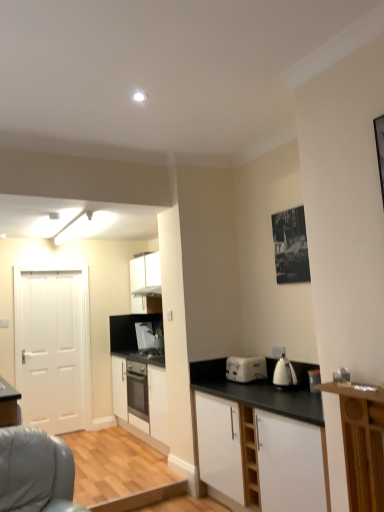
Question: Considering the relative positions of white matte door at left and black paper poster at upper right in the image provided, is white matte door at left to the left of black paper poster at upper right from the viewer's perspective?

Choices:
 (A) yes
 (B) no

Answer: (A)

Question: Is white matte door at left next to black paper poster at upper right and touching it?

Choices:
 (A) no
 (B) yes

Answer: (A)

Question: Can you confirm if white matte door at left is shorter than black paper poster at upper right?

Choices:
 (A) yes
 (B) no

Answer: (B)

Question: Would you say black paper poster at upper right is part of white matte door at left's contents?

Choices:
 (A) yes
 (B) no

Answer: (B)

Question: Is white matte door at left positioned beyond the bounds of black paper poster at upper right?

Choices:
 (A) yes
 (B) no

Answer: (A)

Question: From the image's perspective, is white matte door at left beneath black paper poster at upper right?

Choices:
 (A) no
 (B) yes

Answer: (B)

Question: Is white matte cabinet at lower right, marked as the 1th cabinetry in a front-to-back arrangement, beside white plastic toaster at center?

Choices:
 (A) no
 (B) yes

Answer: (A)

Question: Is white matte cabinet at lower right, marked as the 1th cabinetry in a front-to-back arrangement, positioned far away from white plastic toaster at center?

Choices:
 (A) no
 (B) yes

Answer: (A)

Question: Is white matte cabinet at lower right, marked as the 1th cabinetry in a front-to-back arrangement, smaller than white plastic toaster at center?

Choices:
 (A) no
 (B) yes

Answer: (A)

Question: Is white matte cabinet at lower right, marked as the 1th cabinetry in a front-to-back arrangement, completely or partially outside of white plastic toaster at center?

Choices:
 (A) no
 (B) yes

Answer: (B)

Question: From a real-world perspective, is white matte cabinet at lower right, the third cabinetry in the back-to-front sequence, positioned over white plastic toaster at center based on gravity?

Choices:
 (A) yes
 (B) no

Answer: (B)

Question: Does white matte cabinet at lower right, the third cabinetry in the back-to-front sequence, have a greater width compared to white plastic toaster at center?

Choices:
 (A) yes
 (B) no

Answer: (A)

Question: Can you confirm if white matte cabinet at center, which is counted as the first cabinetry, starting from the back, is thinner than black paper poster at upper right?

Choices:
 (A) yes
 (B) no

Answer: (B)